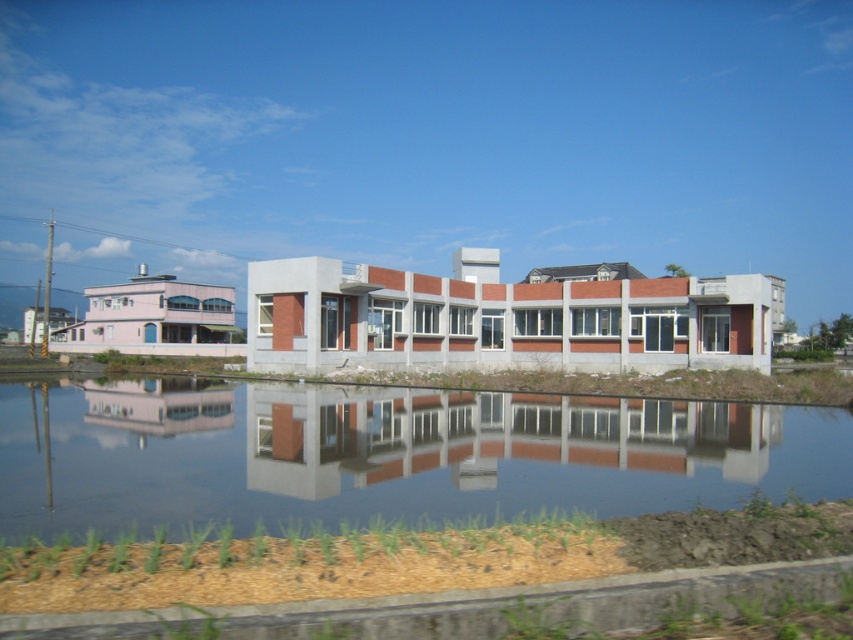
Question: Which point is closer to the camera?

Choices:
 (A) (566, 481)
 (B) (390, 429)

Answer: (A)

Question: Is smooth reflective water at center thinner than smooth concrete building at center?

Choices:
 (A) no
 (B) yes

Answer: (A)

Question: Can you confirm if smooth reflective water at center is thinner than smooth concrete building at center?

Choices:
 (A) yes
 (B) no

Answer: (B)

Question: Can you confirm if smooth reflective water at center is positioned below smooth concrete building at center?

Choices:
 (A) no
 (B) yes

Answer: (B)

Question: Which of the following is the farthest from the observer?

Choices:
 (A) smooth reflective water at center
 (B) smooth concrete building at center

Answer: (B)